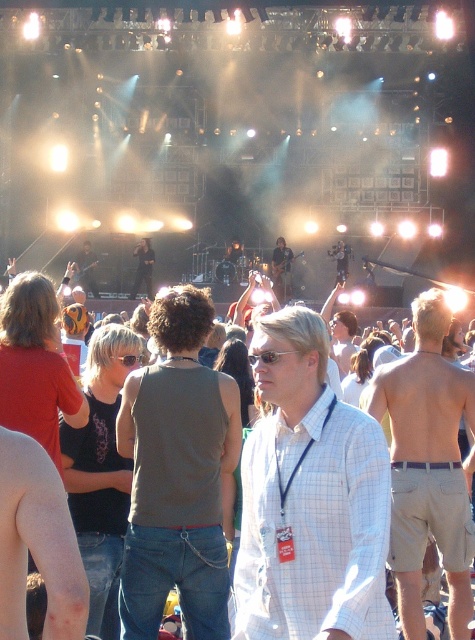
This screenshot has height=640, width=475. In order to click on white checkered shirt at center in this screenshot , I will do `click(310, 499)`.

Does white checkered shirt at center have a greater height compared to tan shorts at center?

In fact, white checkered shirt at center may be shorter than tan shorts at center.

Does point (330, 518) come in front of point (389, 563)?

That is True.

Where is `white checkered shirt at center`? This screenshot has height=640, width=475. white checkered shirt at center is located at coordinates (310, 499).

Does white checkered shirt at center have a greater width compared to dark gray tank top at center?

Correct, the width of white checkered shirt at center exceeds that of dark gray tank top at center.

Can you confirm if white checkered shirt at center is positioned to the right of dark gray tank top at center?

Indeed, white checkered shirt at center is positioned on the right side of dark gray tank top at center.

Identify the location of white checkered shirt at center. (310, 499).

Image resolution: width=475 pixels, height=640 pixels. I want to click on white checkered shirt at center, so click(x=310, y=499).

The width and height of the screenshot is (475, 640). What do you see at coordinates (292, 360) in the screenshot?
I see `denim jeans at center` at bounding box center [292, 360].

Is denim jeans at center further to camera compared to smooth skin arm at lower left?

Yes, it is.

Is point (456, 612) closer to camera compared to point (45, 618)?

That is False.

The height and width of the screenshot is (640, 475). In order to click on denim jeans at center in this screenshot , I will do `click(292, 360)`.